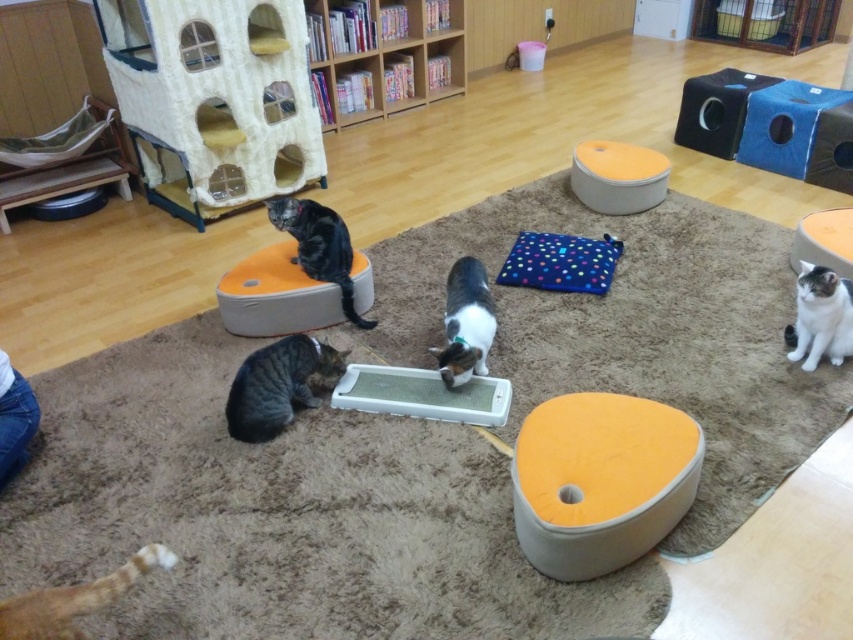
Question: Among these points, which one is nearest to the camera?

Choices:
 (A) (292, 236)
 (B) (370, 38)
 (C) (486, 368)
 (D) (811, 332)

Answer: (D)

Question: Is wooden bookshelf at upper center smaller than black fur cat at center?

Choices:
 (A) yes
 (B) no

Answer: (B)

Question: Which of the following is the closest to the observer?

Choices:
 (A) (x=808, y=310)
 (B) (x=360, y=326)
 (C) (x=45, y=637)
 (D) (x=392, y=35)

Answer: (C)

Question: Is wooden bookshelf at upper center bigger than tabby fur cat at lower left?

Choices:
 (A) yes
 (B) no

Answer: (A)

Question: Among these points, which one is farthest from the camera?

Choices:
 (A) click(x=573, y=308)
 (B) click(x=322, y=224)
 (C) click(x=234, y=410)
 (D) click(x=461, y=326)

Answer: (A)

Question: Is wooden bookshelf at upper center in front of tabby fur cat at lower left?

Choices:
 (A) no
 (B) yes

Answer: (A)